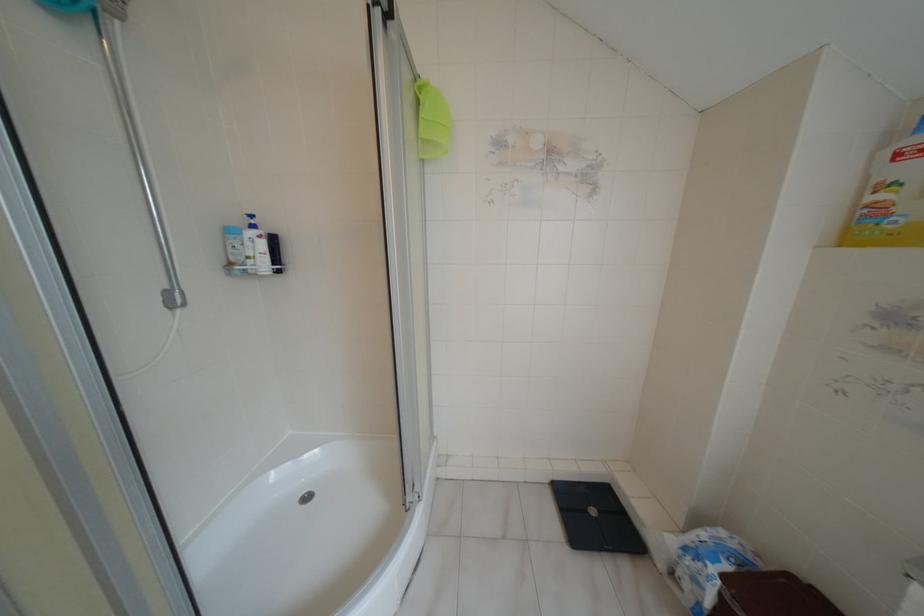
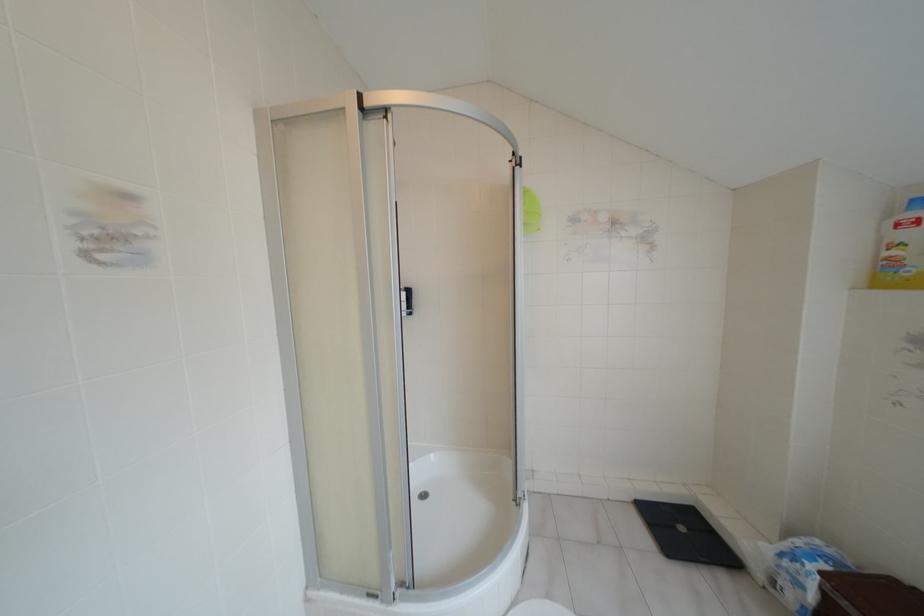
Find the pixel in the second image that matches point (591, 511) in the first image.

(681, 528)